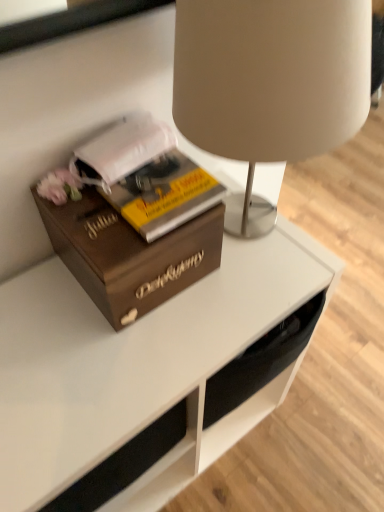
Question: Does matte beige lampshade at upper center have a greater height compared to wooden box at left?

Choices:
 (A) no
 (B) yes

Answer: (B)

Question: Could you tell me if matte beige lampshade at upper center is facing wooden box at left?

Choices:
 (A) yes
 (B) no

Answer: (B)

Question: Is matte beige lampshade at upper center further to the viewer compared to wooden box at left?

Choices:
 (A) no
 (B) yes

Answer: (A)

Question: From a real-world perspective, is matte beige lampshade at upper center located beneath wooden box at left?

Choices:
 (A) yes
 (B) no

Answer: (B)

Question: Can you confirm if matte beige lampshade at upper center is wider than wooden box at left?

Choices:
 (A) yes
 (B) no

Answer: (A)

Question: Which is correct: yellow matte book at center is inside matte beige lampshade at upper center, or outside of it?

Choices:
 (A) inside
 (B) outside

Answer: (B)

Question: In the image, is yellow matte book at center positioned in front of or behind matte beige lampshade at upper center?

Choices:
 (A) front
 (B) behind

Answer: (B)

Question: From a real-world perspective, is yellow matte book at center physically located above or below matte beige lampshade at upper center?

Choices:
 (A) below
 (B) above

Answer: (A)

Question: Based on their sizes in the image, would you say yellow matte book at center is bigger or smaller than matte beige lampshade at upper center?

Choices:
 (A) small
 (B) big

Answer: (A)

Question: From a real-world perspective, relative to wooden box at left, is yellow matte book at center vertically above or below?

Choices:
 (A) above
 (B) below

Answer: (A)

Question: In terms of width, does yellow matte book at center look wider or thinner when compared to wooden box at left?

Choices:
 (A) wide
 (B) thin

Answer: (B)

Question: Is yellow matte book at center spatially inside wooden box at left, or outside of it?

Choices:
 (A) outside
 (B) inside

Answer: (B)

Question: Considering the positions of yellow matte book at center and wooden box at left in the image, is yellow matte book at center taller or shorter than wooden box at left?

Choices:
 (A) tall
 (B) short

Answer: (B)

Question: Choose the correct answer: Is yellow matte book at center inside white matte book at left or outside it?

Choices:
 (A) inside
 (B) outside

Answer: (A)

Question: Considering the positions of yellow matte book at center and white matte book at left in the image, is yellow matte book at center wider or thinner than white matte book at left?

Choices:
 (A) wide
 (B) thin

Answer: (A)